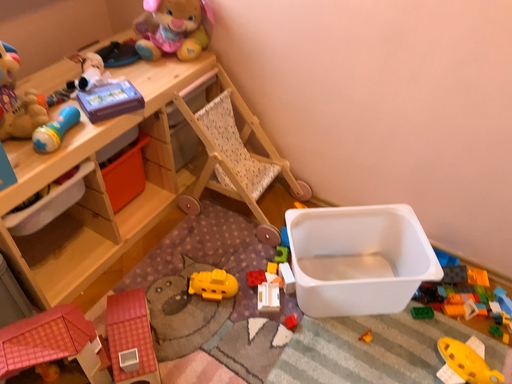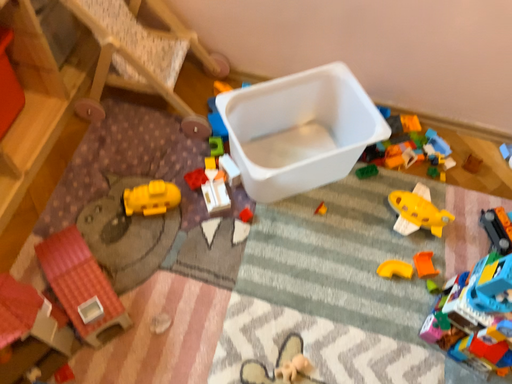
Question: How did the camera likely rotate when shooting the video?

Choices:
 (A) rotated right
 (B) rotated left

Answer: (A)